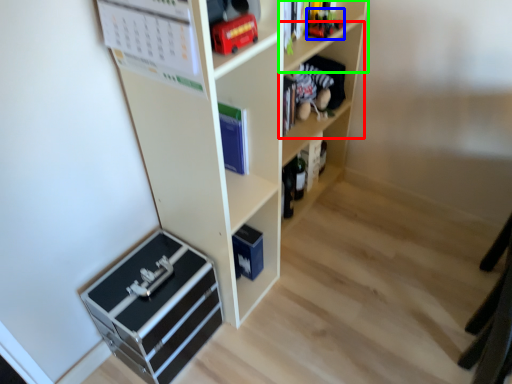
Question: Which object is the closest to the shelf (highlighted by a red box)? Choose among these: toy (highlighted by a blue box) or shelf (highlighted by a green box).

Choices:
 (A) toy
 (B) shelf

Answer: (B)